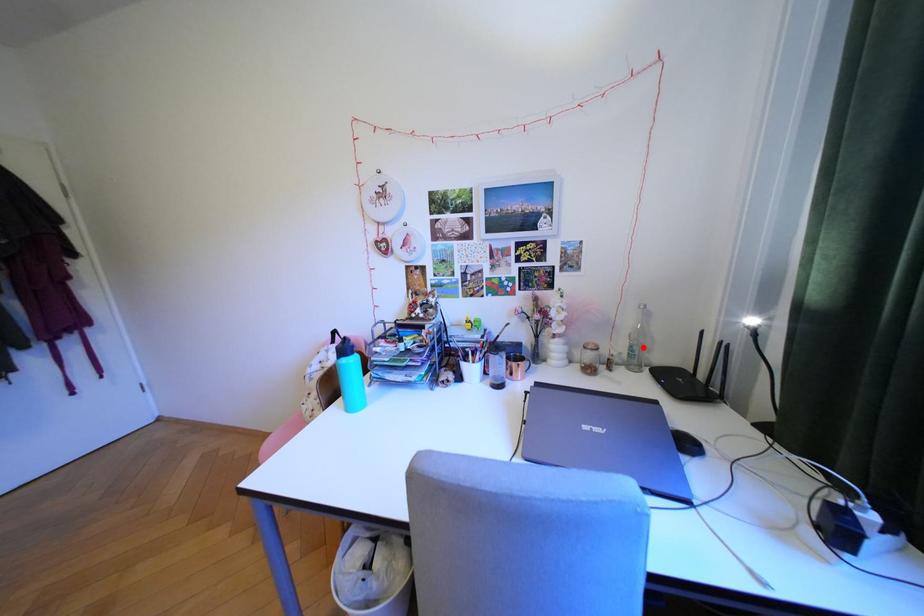
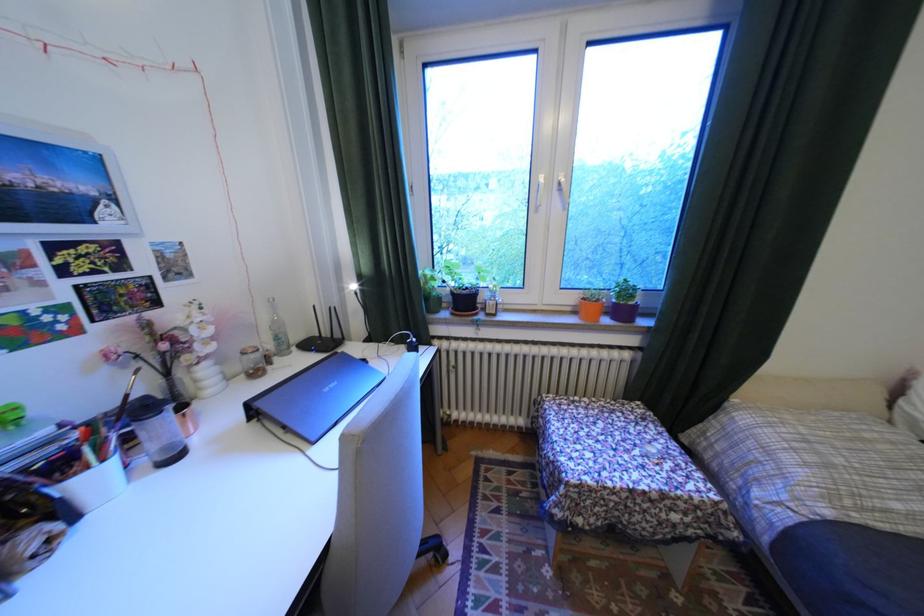
In the second image, find the point that corresponds to the highlighted location in the first image.

(287, 338)